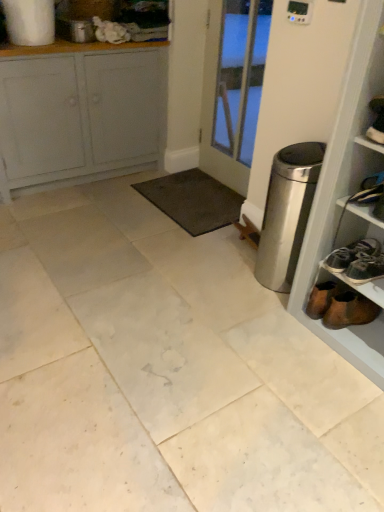
Question: In terms of height, does brown suede boot at lower right look taller or shorter compared to stainless steel trash can at right?

Choices:
 (A) tall
 (B) short

Answer: (B)

Question: From the image's perspective, is brown suede boot at lower right positioned above or below stainless steel trash can at right?

Choices:
 (A) below
 (B) above

Answer: (A)

Question: Considering the real-world distances, which object is closest to the stainless steel trash can at right?

Choices:
 (A) white marble tile at center
 (B) brown suede boot at lower right
 (C) dark gray carpet at center
 (D) white painted wood door at center
 (E) white painted wood cabinet at upper left

Answer: (B)

Question: Which object is positioned farthest from the stainless steel trash can at right?

Choices:
 (A) white painted wood door at center
 (B) white marble tile at center
 (C) brown suede boot at lower right
 (D) white painted wood cabinet at upper left
 (E) dark gray carpet at center

Answer: (D)